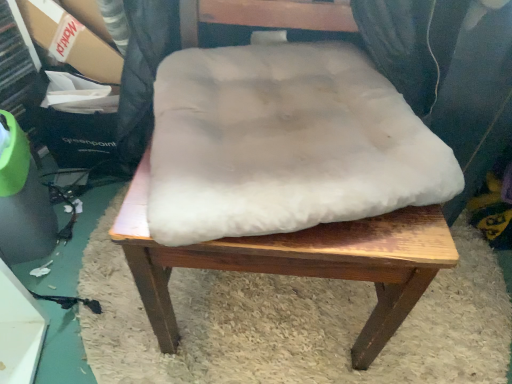
Question: Is white fluffy cushion at center turned away from white fluffy cushion at center?

Choices:
 (A) yes
 (B) no

Answer: (B)

Question: Considering the relative positions of white fluffy cushion at center and white fluffy cushion at center in the image provided, is white fluffy cushion at center to the left of white fluffy cushion at center from the viewer's perspective?

Choices:
 (A) no
 (B) yes

Answer: (A)

Question: Does white fluffy cushion at center come behind white fluffy cushion at center?

Choices:
 (A) no
 (B) yes

Answer: (B)

Question: From a real-world perspective, is white fluffy cushion at center on top of white fluffy cushion at center?

Choices:
 (A) no
 (B) yes

Answer: (A)

Question: Considering the relative sizes of white fluffy cushion at center and white fluffy cushion at center in the image provided, is white fluffy cushion at center wider than white fluffy cushion at center?

Choices:
 (A) no
 (B) yes

Answer: (B)

Question: From a real-world perspective, is white fluffy cushion at center positioned under white fluffy cushion at center based on gravity?

Choices:
 (A) no
 (B) yes

Answer: (B)

Question: From the image's perspective, is white fluffy cushion at center below white fluffy cushion at center?

Choices:
 (A) yes
 (B) no

Answer: (B)

Question: Can you confirm if white fluffy cushion at center is positioned to the left of white fluffy cushion at center?

Choices:
 (A) no
 (B) yes

Answer: (B)

Question: Does white fluffy cushion at center lie behind white fluffy cushion at center?

Choices:
 (A) no
 (B) yes

Answer: (A)

Question: Is white fluffy cushion at center inside white fluffy cushion at center?

Choices:
 (A) no
 (B) yes

Answer: (A)

Question: From a real-world perspective, is white fluffy cushion at center located beneath white fluffy cushion at center?

Choices:
 (A) yes
 (B) no

Answer: (B)

Question: Is white fluffy cushion at center touching white fluffy cushion at center?

Choices:
 (A) no
 (B) yes

Answer: (A)

Question: Does white fluffy cushion at center appear on the left side of white fluffy cushion at center?

Choices:
 (A) no
 (B) yes

Answer: (B)